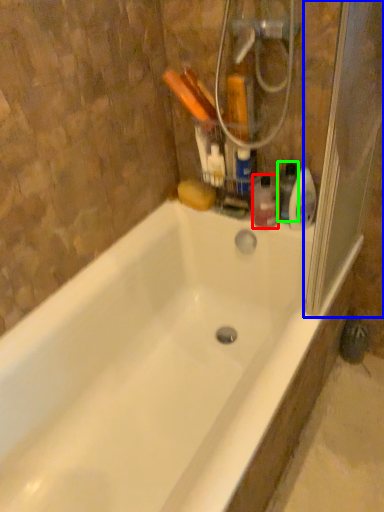
Question: Based on their relative distances, which object is farther from toiletry (highlighted by a red box)? Choose from screen door (highlighted by a blue box) and cleaning product (highlighted by a green box).

Choices:
 (A) screen door
 (B) cleaning product

Answer: (A)